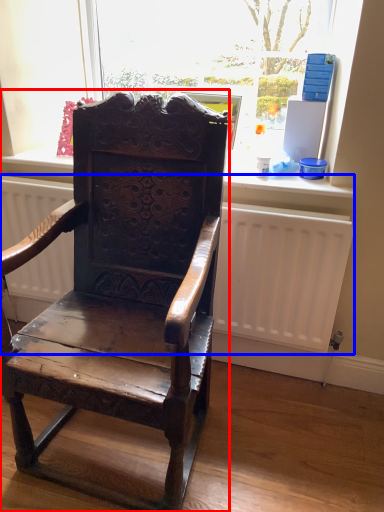
Question: Which of the following is the farthest to the observer, chair (highlighted by a red box) or radiator (highlighted by a blue box)?

Choices:
 (A) chair
 (B) radiator

Answer: (B)